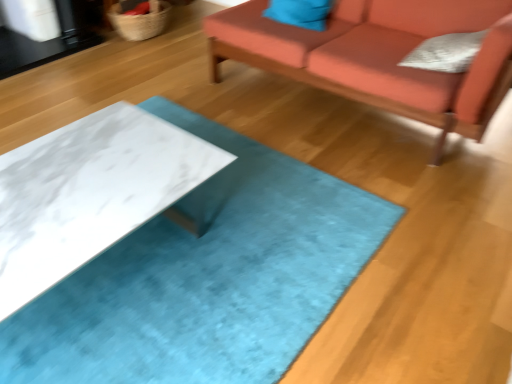
Locate an element on the screen. Image resolution: width=512 pixels, height=384 pixels. velvet orange couch at upper right is located at coordinates [380, 56].

What do you see at coordinates (380, 56) in the screenshot?
I see `velvet orange couch at upper right` at bounding box center [380, 56].

What is the approximate width of white textured pillow at upper right, the 2th pillow positioned from the left?

white textured pillow at upper right, the 2th pillow positioned from the left, is 13.37 inches wide.

In order to face woven natural fiber basket at upper left, should I rotate leftwards or rightwards?

Turn left approximately 15.526 degrees to face it.

Find the location of `matte blue pillow at upper center, positioned as the 2th pillow in front-to-back order`. matte blue pillow at upper center, positioned as the 2th pillow in front-to-back order is located at coordinates (300, 13).

What do you see at coordinates (90, 193) in the screenshot? I see `white marble table at center` at bounding box center [90, 193].

Identify the location of velvet orange couch at upper right. The height and width of the screenshot is (384, 512). (380, 56).

Is white textured pillow at upper right, which appears as the 1th pillow when ordered from the bottom, at the left side of woven natural fiber basket at upper left?

Incorrect, white textured pillow at upper right, which appears as the 1th pillow when ordered from the bottom, is not on the left side of woven natural fiber basket at upper left.

Considering the relative sizes of white textured pillow at upper right, which ranks as the 2th pillow in top-to-bottom order, and woven natural fiber basket at upper left in the image provided, is white textured pillow at upper right, which ranks as the 2th pillow in top-to-bottom order, bigger than woven natural fiber basket at upper left?

Incorrect, white textured pillow at upper right, which ranks as the 2th pillow in top-to-bottom order, is not larger than woven natural fiber basket at upper left.

Is white textured pillow at upper right, the first pillow when ordered from right to left, next to woven natural fiber basket at upper left?

There is a gap between white textured pillow at upper right, the first pillow when ordered from right to left, and woven natural fiber basket at upper left.

From a real-world perspective, is white marble table at center on top of white textured pillow at upper right, the 1th pillow positioned from the front?

No.

Where is `table that appears in front of the white textured pillow at upper right, the 1th pillow positioned from the front`? This screenshot has width=512, height=384. table that appears in front of the white textured pillow at upper right, the 1th pillow positioned from the front is located at coordinates (90, 193).

Would you say white marble table at center is outside white textured pillow at upper right, the 1th pillow positioned from the front?

white marble table at center lies outside white textured pillow at upper right, the 1th pillow positioned from the front,'s area.

Is woven natural fiber basket at upper left facing towards white marble table at center?

No, woven natural fiber basket at upper left is not oriented towards white marble table at center.

What's the angular difference between woven natural fiber basket at upper left and white marble table at center's facing directions?

The angular difference between woven natural fiber basket at upper left and white marble table at center is 87 degrees.

From the image's perspective, which is below, woven natural fiber basket at upper left or white marble table at center?

white marble table at center, from the image's perspective.

From their relative heights in the image, would you say woven natural fiber basket at upper left is taller or shorter than white marble table at center?

Considering their sizes, woven natural fiber basket at upper left has less height than white marble table at center.

Considering the relative sizes of matte blue pillow at upper center, which is the second pillow from right to left, and white textured pillow at upper right, which appears as the 1th pillow when ordered from the bottom, in the image provided, is matte blue pillow at upper center, which is the second pillow from right to left, shorter than white textured pillow at upper right, which appears as the 1th pillow when ordered from the bottom,?

Yes, matte blue pillow at upper center, which is the second pillow from right to left, is shorter than white textured pillow at upper right, which appears as the 1th pillow when ordered from the bottom.

Based on their positions, is matte blue pillow at upper center, placed as the first pillow when sorted from top to bottom, located to the left or right of white textured pillow at upper right, positioned as the second pillow in back-to-front order?

matte blue pillow at upper center, placed as the first pillow when sorted from top to bottom, is positioned on white textured pillow at upper right, positioned as the second pillow in back-to-front order,'s left side.

Considering the sizes of matte blue pillow at upper center, which ranks as the first pillow in back-to-front order, and white textured pillow at upper right, positioned as the second pillow in back-to-front order, in the image, is matte blue pillow at upper center, which ranks as the first pillow in back-to-front order, wider or thinner than white textured pillow at upper right, positioned as the second pillow in back-to-front order,?

Result: In the image, matte blue pillow at upper center, which ranks as the first pillow in back-to-front order, appears to be more narrow than white textured pillow at upper right, positioned as the second pillow in back-to-front order.

From a real-world perspective, is matte blue pillow at upper center, which is counted as the second pillow, starting from the bottom, positioned above or below white textured pillow at upper right, the 2th pillow positioned from the left?

From a real-world perspective, matte blue pillow at upper center, which is counted as the second pillow, starting from the bottom, is physically below white textured pillow at upper right, the 2th pillow positioned from the left.

Looking at this image, can you confirm if white marble table at center is positioned to the right of matte blue pillow at upper center, which ranks as the first pillow in back-to-front order?

No, white marble table at center is not to the right of matte blue pillow at upper center, which ranks as the first pillow in back-to-front order.

Could you tell me if white marble table at center is facing matte blue pillow at upper center, which is the second pillow from right to left?

Yes, white marble table at center is turned towards matte blue pillow at upper center, which is the second pillow from right to left.

Could matte blue pillow at upper center, which is the second pillow from right to left, be considered to be inside white marble table at center?

No, matte blue pillow at upper center, which is the second pillow from right to left, is not inside white marble table at center.

Is white marble table at center wider or thinner than matte blue pillow at upper center, which appears as the 1th pillow when viewed from the left?

white marble table at center is wider than matte blue pillow at upper center, which appears as the 1th pillow when viewed from the left.

How many degrees apart are the facing directions of white textured pillow at upper right, the 1th pillow positioned from the front, and white marble table at center?

white textured pillow at upper right, the 1th pillow positioned from the front, and white marble table at center are facing 93.1 degrees away from each other.

Is white textured pillow at upper right, the first pillow when ordered from right to left, touching white marble table at center?

No, white textured pillow at upper right, the first pillow when ordered from right to left, is not in contact with white marble table at center.

Could you measure the distance between white textured pillow at upper right, positioned as the second pillow in back-to-front order, and white marble table at center?

They are 1.46 meters apart.

Looking at the image, does white textured pillow at upper right, which ranks as the 2th pillow in top-to-bottom order, seem bigger or smaller compared to white marble table at center?

Clearly, white textured pillow at upper right, which ranks as the 2th pillow in top-to-bottom order, is smaller in size than white marble table at center.

Is white marble table at center not near woven natural fiber basket at upper left?

That's right, there is a large distance between white marble table at center and woven natural fiber basket at upper left.

Is white marble table at center positioned with its back to woven natural fiber basket at upper left?

No, white marble table at center's orientation is not away from woven natural fiber basket at upper left.

There is a woven natural fiber basket at upper left. What are the coordinates of `the 2nd pillow above it (from a real-world perspective)` in the screenshot? It's located at (446, 52).

Starting from the white marble table at center, which pillow is the 2nd one to the right? Please provide its 2D coordinates.

[(446, 52)]

From the image, which object appears to be nearer to white textured pillow at upper right, which appears as the 1th pillow when ordered from the bottom, matte blue pillow at upper center, positioned as the 2th pillow in front-to-back order, or woven natural fiber basket at upper left?

Based on the image, matte blue pillow at upper center, positioned as the 2th pillow in front-to-back order, appears to be nearer to white textured pillow at upper right, which appears as the 1th pillow when ordered from the bottom.

From the image, which object appears to be nearer to white textured pillow at upper right, which ranks as the 2th pillow in top-to-bottom order, velvet orange couch at upper right or white marble table at center?

velvet orange couch at upper right is positioned closer to the anchor white textured pillow at upper right, which ranks as the 2th pillow in top-to-bottom order.

Estimate the real-world distances between objects in this image. Which object is further from white textured pillow at upper right, which ranks as the 2th pillow in top-to-bottom order, velvet orange couch at upper right or matte blue pillow at upper center, which ranks as the first pillow in back-to-front order?

matte blue pillow at upper center, which ranks as the first pillow in back-to-front order, is positioned further to the anchor white textured pillow at upper right, which ranks as the 2th pillow in top-to-bottom order.

Which object lies further to the anchor point white textured pillow at upper right, the first pillow when ordered from right to left, white marble table at center or matte blue pillow at upper center, which is the second pillow from right to left?

white marble table at center lies further to white textured pillow at upper right, the first pillow when ordered from right to left, than the other object.

When comparing their distances from white textured pillow at upper right, the 2th pillow positioned from the left, does white marble table at center or velvet orange couch at upper right seem closer?

velvet orange couch at upper right lies closer to white textured pillow at upper right, the 2th pillow positioned from the left, than the other object.

Which object lies further to the anchor point white textured pillow at upper right, the 1th pillow positioned from the front, matte blue pillow at upper center, positioned as the 2th pillow in front-to-back order, or velvet orange couch at upper right?

The object further to white textured pillow at upper right, the 1th pillow positioned from the front, is matte blue pillow at upper center, positioned as the 2th pillow in front-to-back order.

Based on their spatial positions, is white marble table at center or velvet orange couch at upper right closer to matte blue pillow at upper center, placed as the first pillow when sorted from top to bottom?

velvet orange couch at upper right lies closer to matte blue pillow at upper center, placed as the first pillow when sorted from top to bottom, than the other object.

Looking at the image, which one is located closer to white marble table at center, matte blue pillow at upper center, which is the second pillow from right to left, or woven natural fiber basket at upper left?

Based on the image, matte blue pillow at upper center, which is the second pillow from right to left, appears to be nearer to white marble table at center.

You are a GUI agent. You are given a task and a screenshot of the screen. Output one action in this format:
    pyautogui.click(x=<x>, y=<y>)
    Task: Click on the studio couch between woven natural fiber basket at upper left and white textured pillow at upper right, which ranks as the 2th pillow in top-to-bottom order
    The width and height of the screenshot is (512, 384).
    Given the screenshot: What is the action you would take?
    pyautogui.click(x=380, y=56)

At what (x,y) coordinates should I click in order to perform the action: click on studio couch between white marble table at center and matte blue pillow at upper center, which is the second pillow from right to left, along the z-axis. Please return your answer as a coordinate pair (x, y). Looking at the image, I should click on (380, 56).

In order to click on table between woven natural fiber basket at upper left and white textured pillow at upper right, which ranks as the 2th pillow in top-to-bottom order, from left to right in this screenshot , I will do `click(90, 193)`.

Find the location of `studio couch between white marble table at center and woven natural fiber basket at upper left along the z-axis`. studio couch between white marble table at center and woven natural fiber basket at upper left along the z-axis is located at coordinates (x=380, y=56).